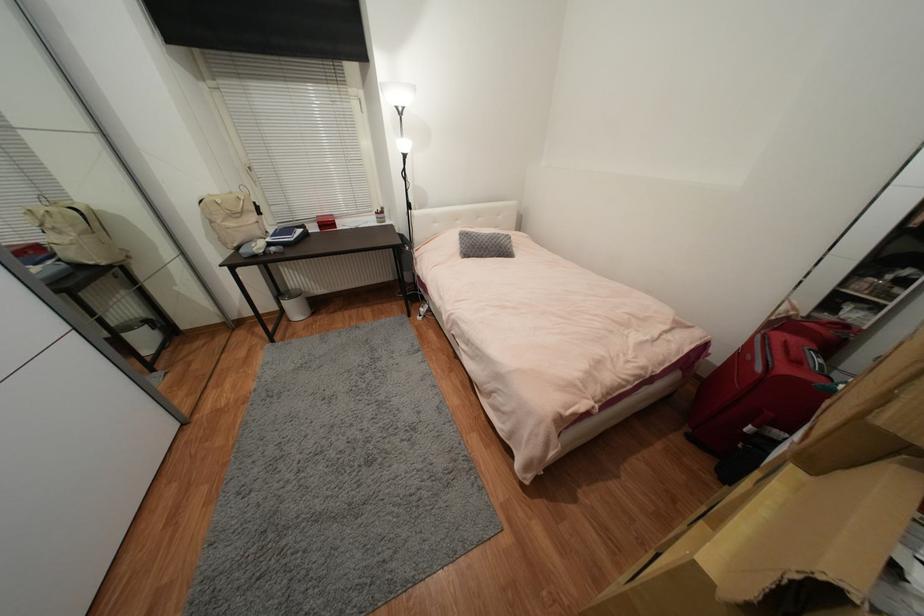
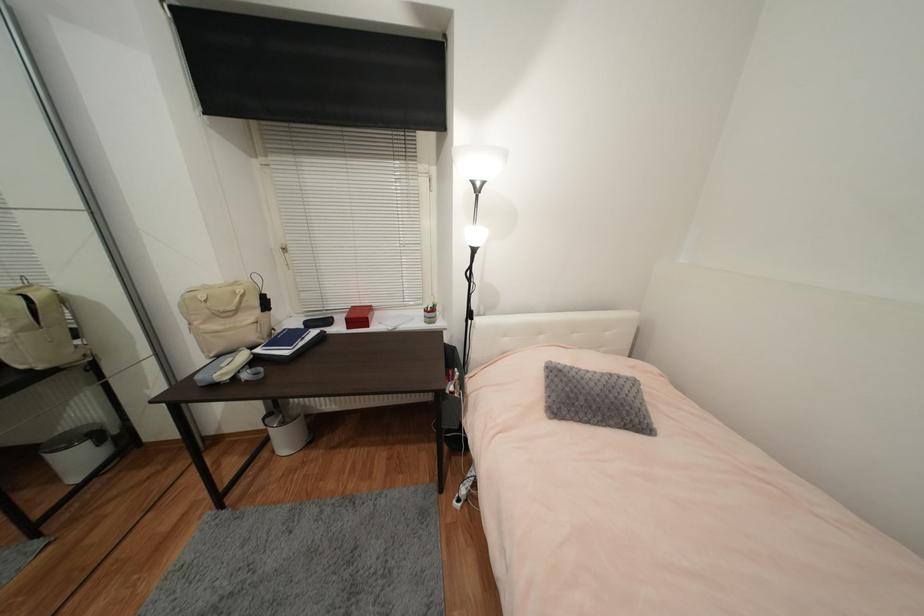
Where in the second image is the point corresponding to point (300, 236) from the first image?

(306, 344)